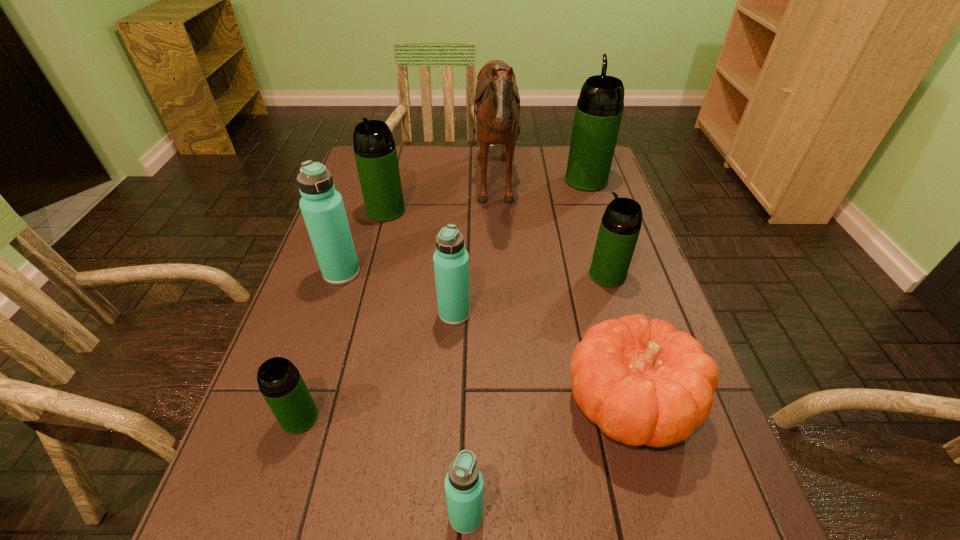
Find the location of a particular element. vacant space located 0.070m from the spout of the third nearest green thermos bottle is located at coordinates (378, 238).

Where is `vacant region located 0.180m on the back of the farthest aqua thermos bottle`? The image size is (960, 540). vacant region located 0.180m on the back of the farthest aqua thermos bottle is located at coordinates (359, 218).

Locate an element on the screen. The image size is (960, 540). free space located on the right of the sixth farthest object is located at coordinates (572, 314).

Locate an element on the screen. Image resolution: width=960 pixels, height=540 pixels. free space located 0.050m from the spout of the third farthest green thermos bottle is located at coordinates (568, 275).

This screenshot has height=540, width=960. I want to click on vacant space situated 0.270m from the spout of the third farthest green thermos bottle, so pyautogui.click(x=479, y=275).

You are a GUI agent. You are given a task and a screenshot of the screen. Output one action in this format:
    pyautogui.click(x=<x>, y=<y>)
    Task: Click on the free space located 0.220m from the spout of the third farthest green thermos bottle
    The height and width of the screenshot is (540, 960).
    Given the screenshot: What is the action you would take?
    pyautogui.click(x=499, y=275)

Where is `vacant space located from the spout of the second nearest thermos bottle`? The height and width of the screenshot is (540, 960). vacant space located from the spout of the second nearest thermos bottle is located at coordinates (277, 487).

Image resolution: width=960 pixels, height=540 pixels. I want to click on free space located on the right of the nearest object, so click(713, 516).

The width and height of the screenshot is (960, 540). What are the coordinates of `free space located on the left of the orange pumpkin` in the screenshot? It's located at (358, 403).

At what (x,y) coordinates should I click in order to perform the action: click on saddle at the far edge. Please return your answer as a coordinate pair (x, y). Looking at the image, I should click on (497, 102).